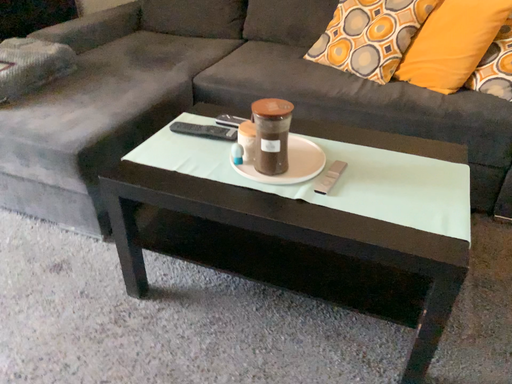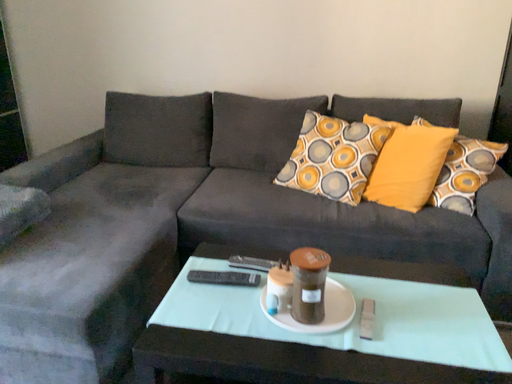
Question: Which way did the camera rotate in the video?

Choices:
 (A) rotated left
 (B) rotated right

Answer: (B)